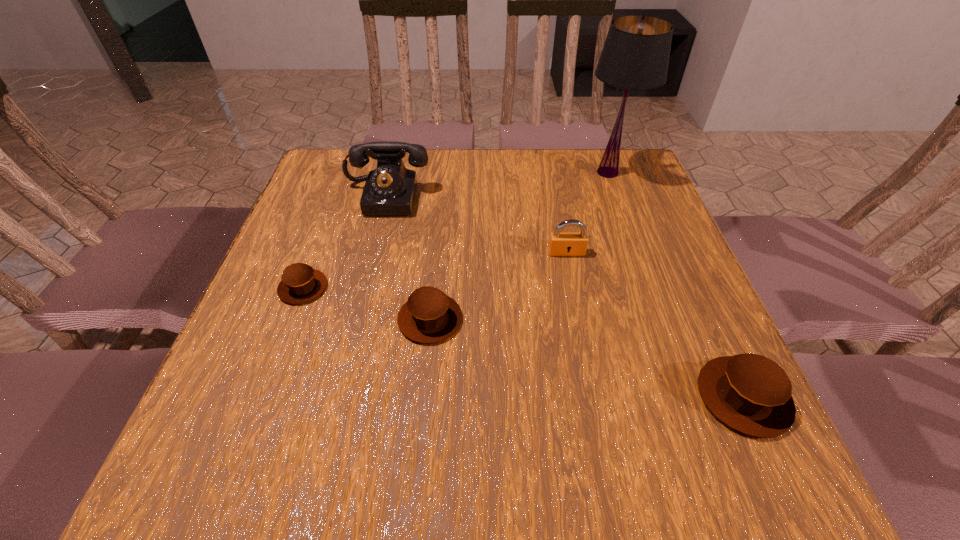
Locate an element on the screen. telephone at the left edge is located at coordinates click(x=390, y=189).

Identify the location of muffin that is at the right edge. Image resolution: width=960 pixels, height=540 pixels. (750, 393).

The height and width of the screenshot is (540, 960). What are the coordinates of `lampshade located at the right edge` in the screenshot? It's located at (635, 56).

What are the coordinates of `object located at the far left corner` in the screenshot? It's located at (390, 189).

Locate an element on the screen. This screenshot has width=960, height=540. object that is positioned at the far right corner is located at coordinates (635, 56).

The width and height of the screenshot is (960, 540). I want to click on object that is positioned at the near right corner, so tap(750, 393).

In the image, there is a desktop. In order to click on free space at the far edge in this screenshot , I will do `click(570, 148)`.

Find the location of a particular element. This screenshot has height=540, width=960. vacant space at the near edge of the desktop is located at coordinates (469, 389).

At what (x,y) coordinates should I click in order to perform the action: click on free space at the left edge of the desktop. Please return your answer as a coordinate pair (x, y). Image resolution: width=960 pixels, height=540 pixels. Looking at the image, I should click on (331, 221).

In the image, there is a desktop. At what (x,y) coordinates should I click in order to perform the action: click on free space at the right edge. Please return your answer as a coordinate pair (x, y). Image resolution: width=960 pixels, height=540 pixels. Looking at the image, I should click on (605, 238).